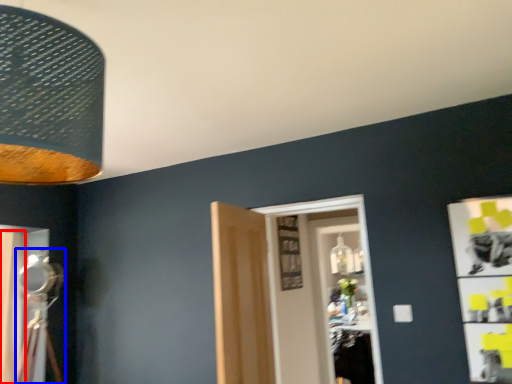
Question: Among these objects, which one is farthest to the camera, curtain (highlighted by a red box) or table lamp (highlighted by a blue box)?

Choices:
 (A) curtain
 (B) table lamp

Answer: (A)